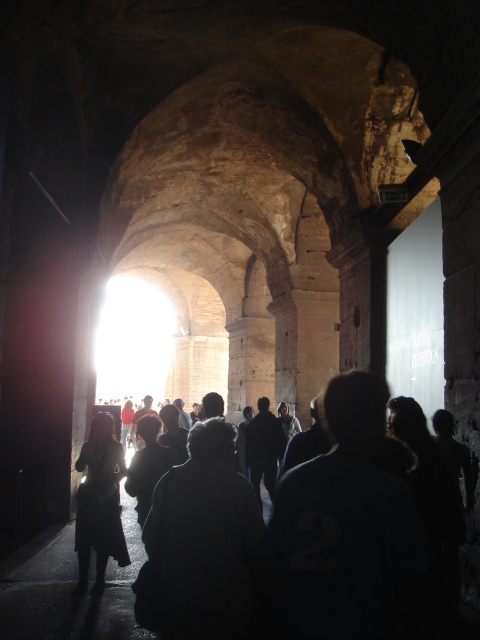
Based on the photo, you are a painter standing in the ancient Roman corridor depicted in the image. You notice two figures at the center of the scene. One is wearing a dark fabric jacket, and the other has dark hair. As you observe them, you want to capture their silhouettes against the bright sunlight coming from the far end. Which object, the dark fabric jacket at center or the dark hair at center, will appear larger in your painting?

The dark fabric jacket at center is bigger than the dark hair at center, so it will appear larger in the painting.

You are standing in the ancient Roman corridor and want to move from the point at coordinates point (343,552) to the point at coordinates point (122,534). Which direction should you walk to get closer to your destination?

To move from point (343,552) to point (122,534), you should walk towards the direction of the bright sunlight at the far end of the corridor since point (122,534) is further away from the camera compared to point (343,552).

You are standing in the ancient Roman corridor and see both the dark fabric jacket at center and the dark hair at center. Which object is nearer to you?

The dark fabric jacket at center is closer to the viewer than the dark hair at center.